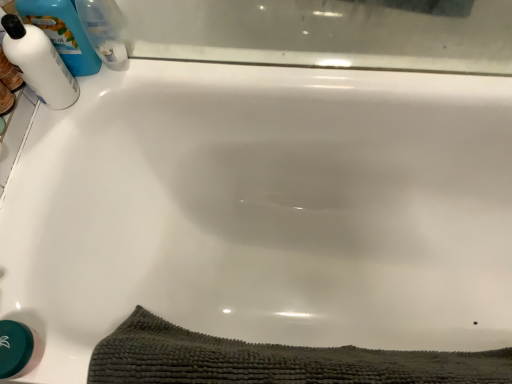
The width and height of the screenshot is (512, 384). Find the location of `free location in front of white glossy bottle at upper left, the 1th cleaning product in the left-to-right sequence`. free location in front of white glossy bottle at upper left, the 1th cleaning product in the left-to-right sequence is located at coordinates (39, 149).